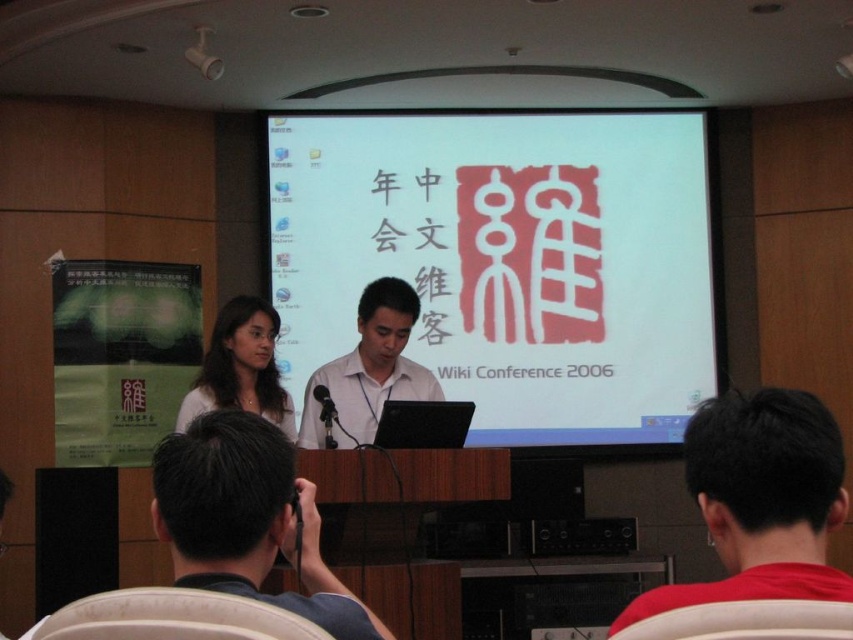
You are an attendee at the Wiki Conference 2006 and want to ask a question. You need to approach the podium where the smooth brown hair at center and the black plastic microphone at center are located. Which object will you encounter first as you walk towards the podium?

The smooth brown hair at center will be encountered first because it is closer to the viewer than the black plastic microphone at center.